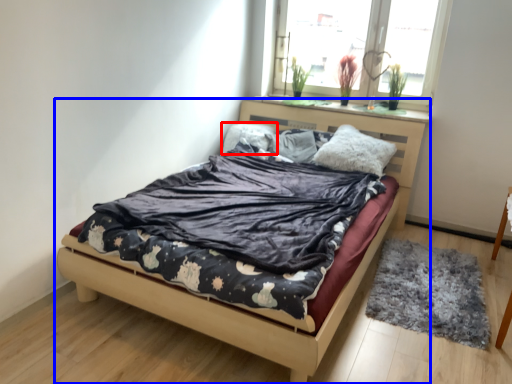
Question: Which object appears farthest to the camera in this image, pillow (highlighted by a red box) or bed (highlighted by a blue box)?

Choices:
 (A) pillow
 (B) bed

Answer: (A)